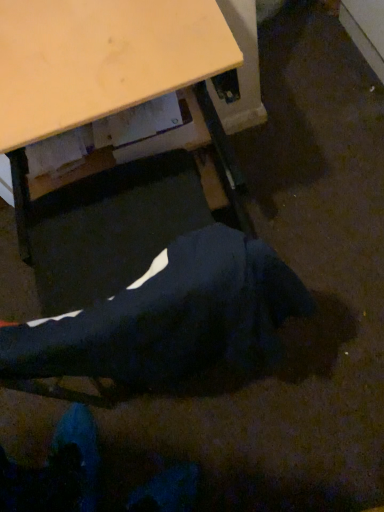
What is the approximate height of wooden desk at center?

29.67 inches.

What do you see at coordinates (100, 59) in the screenshot?
I see `wooden desk at center` at bounding box center [100, 59].

Identify the location of wooden desk at center. (100, 59).

Measure the distance between point (59, 54) and camera.

A distance of 27.56 inches exists between point (59, 54) and camera.

This screenshot has width=384, height=512. I want to click on black fabric robe at lower center, so coord(170,318).

Image resolution: width=384 pixels, height=512 pixels. Describe the element at coordinates (170, 318) in the screenshot. I see `black fabric robe at lower center` at that location.

The height and width of the screenshot is (512, 384). In order to click on wooden desk at center in this screenshot , I will do `click(100, 59)`.

Between black fabric robe at lower center and wooden desk at center, which one appears on the right side from the viewer's perspective?

black fabric robe at lower center is more to the right.

Which object is closer to the camera, black fabric robe at lower center or wooden desk at center?

black fabric robe at lower center.

Considering the points (158, 288) and (120, 15), which point is behind, point (158, 288) or point (120, 15)?

The point (120, 15) is behind.

From the image's perspective, which object appears higher, black fabric robe at lower center or wooden desk at center?

wooden desk at center appears higher in the image.

From a real-world perspective, which is physically below, black fabric robe at lower center or wooden desk at center?

From a 3D spatial view, wooden desk at center is below.

Which of these two, black fabric robe at lower center or wooden desk at center, is thinner?

black fabric robe at lower center.

Does black fabric robe at lower center have a lesser height compared to wooden desk at center?

Indeed, black fabric robe at lower center has a lesser height compared to wooden desk at center.

Between black fabric robe at lower center and wooden desk at center, which one has smaller size?

black fabric robe at lower center.

Is black fabric robe at lower center located outside wooden desk at center?

Indeed, black fabric robe at lower center is completely outside wooden desk at center.

Are black fabric robe at lower center and wooden desk at center far apart?

black fabric robe at lower center is actually quite close to wooden desk at center.

Does black fabric robe at lower center turn towards wooden desk at center?

Yes, black fabric robe at lower center faces towards wooden desk at center.

Can you tell me how much black fabric robe at lower center and wooden desk at center differ in facing direction?

The facing directions of black fabric robe at lower center and wooden desk at center are 180 degrees apart.

Identify the location of robe that appears below the wooden desk at center (from the image's perspective). (170, 318).

Based on the photo, visually, is wooden desk at center positioned to the left or to the right of black fabric robe at lower center?

Based on their positions, wooden desk at center is located to the left of black fabric robe at lower center.

Is the position of wooden desk at center less distant than that of black fabric robe at lower center?

No, wooden desk at center is further to the viewer.

Considering the points (85, 118) and (264, 359), which point is in front, point (85, 118) or point (264, 359)?

Positioned in front is point (85, 118).

From the image's perspective, is wooden desk at center positioned above or below black fabric robe at lower center?

Based on their image positions, wooden desk at center is located above black fabric robe at lower center.

From a real-world perspective, is wooden desk at center physically located above or below black fabric robe at lower center?

From a real-world perspective, wooden desk at center is physically below black fabric robe at lower center.

Which object is thinner, wooden desk at center or black fabric robe at lower center?

black fabric robe at lower center.

Does wooden desk at center have a greater height compared to black fabric robe at lower center?

Indeed, wooden desk at center has a greater height compared to black fabric robe at lower center.

Who is smaller, wooden desk at center or black fabric robe at lower center?

Smaller between the two is black fabric robe at lower center.

Is wooden desk at center spatially inside black fabric robe at lower center, or outside of it?

wooden desk at center is not enclosed by black fabric robe at lower center.

Is wooden desk at center beside black fabric robe at lower center?

wooden desk at center and black fabric robe at lower center are clearly separated.

Could you tell me if wooden desk at center is facing black fabric robe at lower center?

Yes, wooden desk at center is turned towards black fabric robe at lower center.

Measure the distance between wooden desk at center and black fabric robe at lower center.

A distance of 14.11 inches exists between wooden desk at center and black fabric robe at lower center.

What are the coordinates of `robe in front of the wooden desk at center` in the screenshot? It's located at (170, 318).

This screenshot has height=512, width=384. In the image, there is a black fabric robe at lower center. In order to click on desk below it (from a real-world perspective) in this screenshot , I will do `click(100, 59)`.

What are the coordinates of `robe below the wooden desk at center (from the image's perspective)` in the screenshot? It's located at (170, 318).